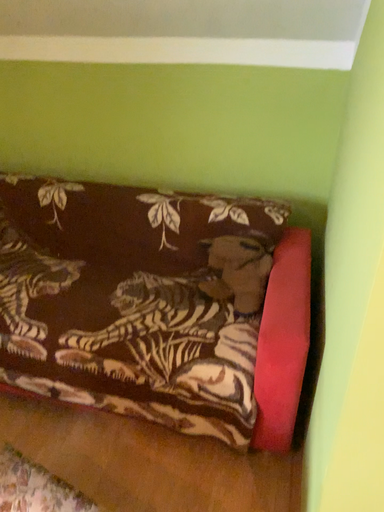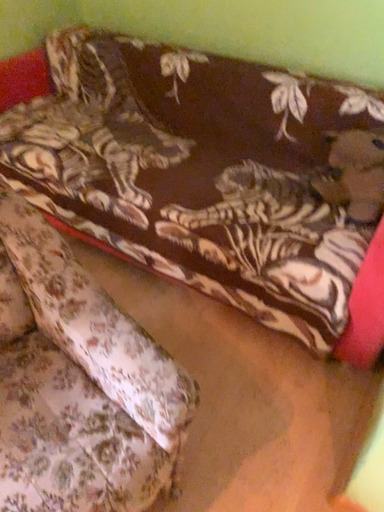
Question: Which way did the camera rotate in the video?

Choices:
 (A) rotated left
 (B) rotated right

Answer: (A)